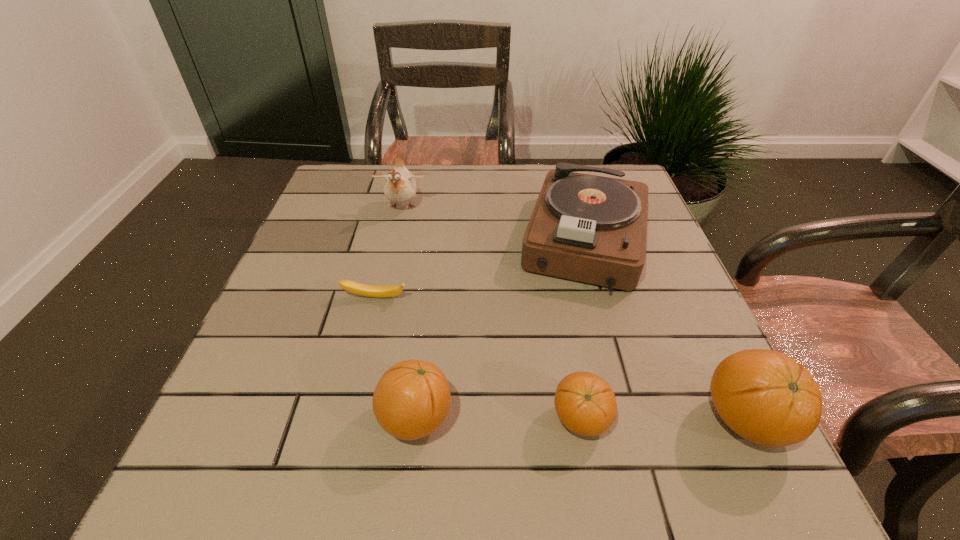
This screenshot has height=540, width=960. In order to click on object situated at the far right corner in this screenshot , I will do `click(593, 229)`.

Identify the location of object present at the near right corner. Image resolution: width=960 pixels, height=540 pixels. (766, 397).

This screenshot has width=960, height=540. In order to click on free space at the far edge of the desktop in this screenshot , I will do point(531,191).

The width and height of the screenshot is (960, 540). Identify the location of free region at the near edge of the desktop. (474, 429).

At what (x,y) coordinates should I click in order to perform the action: click on vacant area at the left edge of the desktop. Please return your answer as a coordinate pair (x, y). The height and width of the screenshot is (540, 960). Looking at the image, I should click on (331, 296).

In order to click on blank area at the right edge in this screenshot , I will do `click(666, 374)`.

This screenshot has width=960, height=540. In the image, there is a desktop. In order to click on vacant space at the far left corner in this screenshot , I will do `click(379, 183)`.

This screenshot has height=540, width=960. Find the location of `free point between the leftmost orange and the record player`. free point between the leftmost orange and the record player is located at coordinates (501, 329).

At what (x,y) coordinates should I click in order to perform the action: click on vacant space that is in between the shortest object and the bird. Please return your answer as a coordinate pair (x, y). This screenshot has width=960, height=540. Looking at the image, I should click on (389, 253).

At what (x,y) coordinates should I click in order to perform the action: click on free spot between the banana and the leftmost orange. Please return your answer as a coordinate pair (x, y). Looking at the image, I should click on (396, 358).